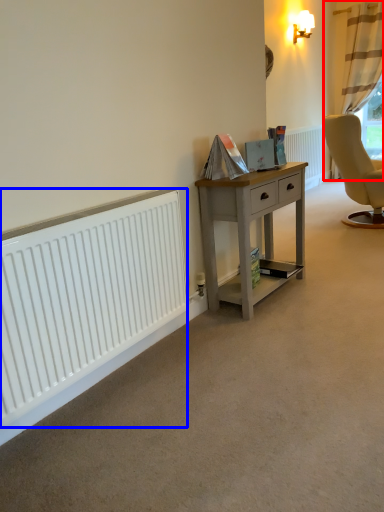
Question: Which object is closer to the camera taking this photo, curtain (highlighted by a red box) or radiator (highlighted by a blue box)?

Choices:
 (A) curtain
 (B) radiator

Answer: (B)